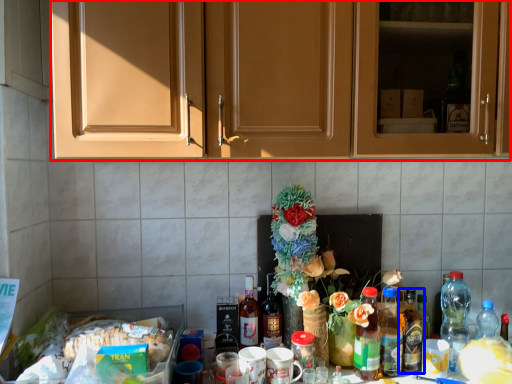
Question: Among these objects, which one is farthest to the camera, cabinetry (highlighted by a red box) or bottle (highlighted by a blue box)?

Choices:
 (A) cabinetry
 (B) bottle

Answer: (B)